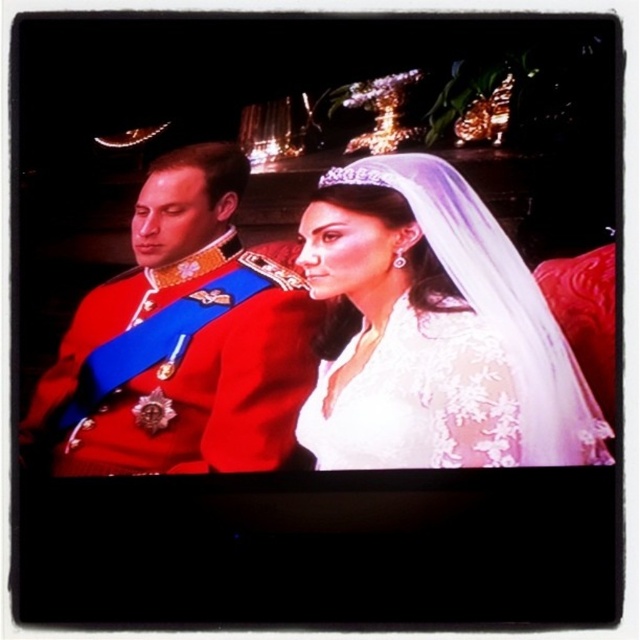
You are an event planner analyzing the image of a formal event. You need to determine the exact position of the white lace veil at upper center in the image. What are its coordinates?

The white lace veil at upper center is located at coordinates (436, 333).

You are a photographer at the event and need to adjust the lighting so that both the white lace dress at center and the clear crystal tiara at upper center are well illuminated. Since one object is taller than the other, which one might require a higher light stand to ensure proper lighting?

The white lace dress at center has a greater height compared to clear crystal tiara at upper center, so the white lace dress at center would need a higher light stand to ensure proper lighting.